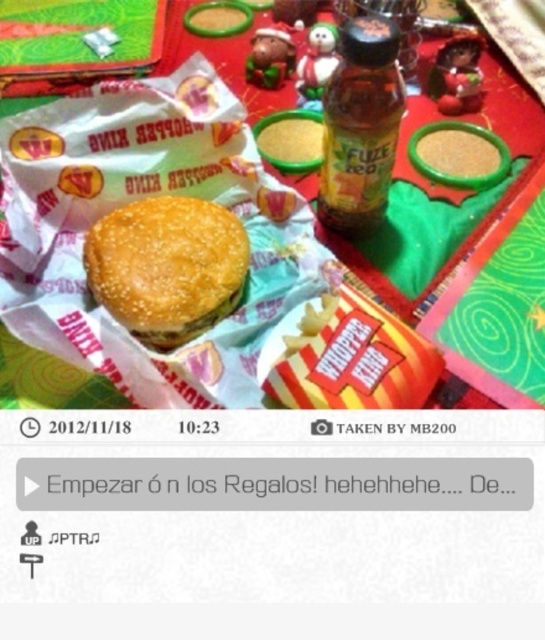
Question: Can you confirm if green matte tray at center is positioned below sesame seed bun at center?

Choices:
 (A) no
 (B) yes

Answer: (A)

Question: Which point is farther to the camera?

Choices:
 (A) translucent plastic bottle at center
 (B) green matte tray at center
 (C) sesame seed bun at center

Answer: (C)

Question: Which point is farther to the camera?

Choices:
 (A) translucent plastic bottle at center
 (B) sesame seed bun at center
 (C) green matte tray at center

Answer: (B)

Question: Among these points, which one is farthest from the camera?

Choices:
 (A) tap(350, 74)
 (B) tap(385, 84)
 (C) tap(221, 209)

Answer: (C)

Question: Is sesame seed bun at center below translucent plastic bottle at center?

Choices:
 (A) no
 (B) yes

Answer: (B)

Question: Can you confirm if sesame seed bun at center is positioned to the left of translucent plastic bottle at center?

Choices:
 (A) no
 (B) yes

Answer: (B)